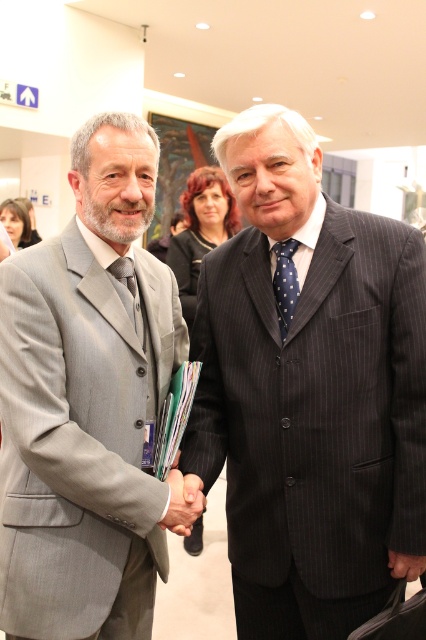
Question: Estimate the real-world distances between objects in this image. Which object is farther from the polka dot silk tie at center?

Choices:
 (A) matte black tie at center
 (B) pinstriped suit at center

Answer: (A)

Question: Observing the image, what is the correct spatial positioning of polka dot silk tie at center in reference to matte black tie at center?

Choices:
 (A) below
 (B) above

Answer: (B)

Question: Does pinstriped suit at center have a greater width compared to matte gray suit at left?

Choices:
 (A) yes
 (B) no

Answer: (A)

Question: Is matte gray suit at left smaller than matte black hand at center?

Choices:
 (A) yes
 (B) no

Answer: (B)

Question: Considering the real-world distances, which object is closest to the matte black hand at center?

Choices:
 (A) pinstriped suit at center
 (B) matte black tie at center
 (C) matte gray suit at left

Answer: (C)

Question: Which object is farther from the camera taking this photo?

Choices:
 (A) matte gray suit at left
 (B) pinstriped suit at center
 (C) matte black tie at center
 (D) matte black hand at center

Answer: (C)